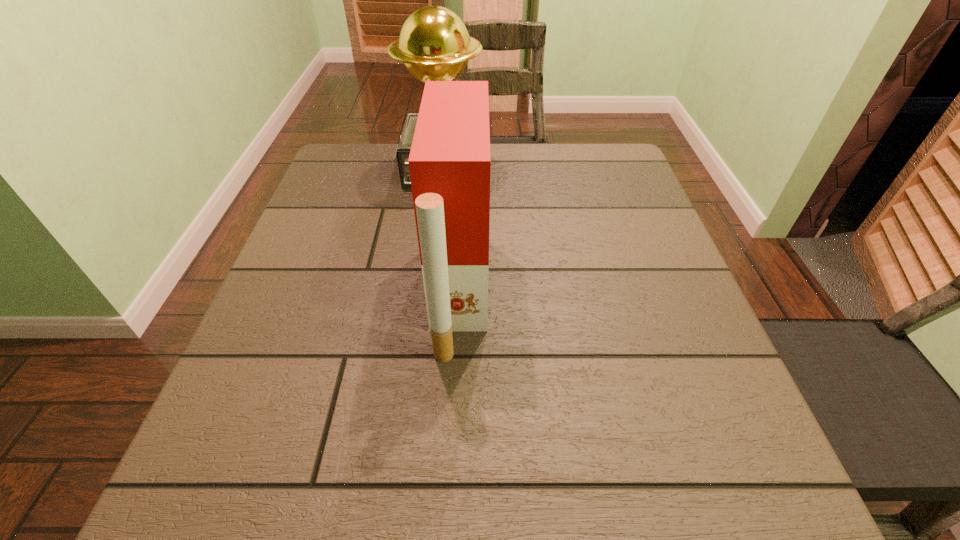
Identify the location of free space at the near left corner of the desktop. Image resolution: width=960 pixels, height=540 pixels. (279, 509).

Find the location of `vacant point at the far right corner`. vacant point at the far right corner is located at coordinates (599, 186).

In order to click on vacant region at the near right corner in this screenshot , I will do `click(678, 458)`.